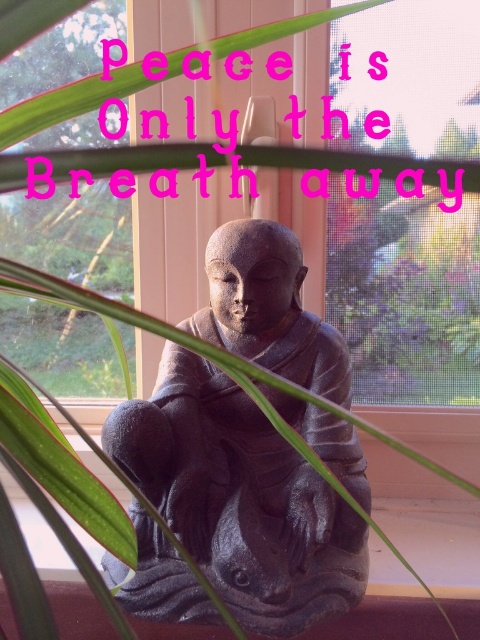
Question: Which point is closer to the camera?

Choices:
 (A) (249, 612)
 (B) (356, 221)

Answer: (A)

Question: Is matte gray stone statue at center wider than transparent mesh at center?

Choices:
 (A) no
 (B) yes

Answer: (B)

Question: Considering the relative positions of matte gray stone statue at center and transparent mesh at center in the image provided, where is matte gray stone statue at center located with respect to transparent mesh at center?

Choices:
 (A) below
 (B) above

Answer: (A)

Question: Observing the image, what is the correct spatial positioning of matte gray stone statue at center in reference to transparent mesh at center?

Choices:
 (A) below
 (B) above

Answer: (A)

Question: Which point is closer to the camera?

Choices:
 (A) matte gray stone statue at center
 (B) transparent mesh at center

Answer: (A)

Question: Among these points, which one is farthest from the camera?

Choices:
 (A) (445, 216)
 (B) (206, 529)

Answer: (A)